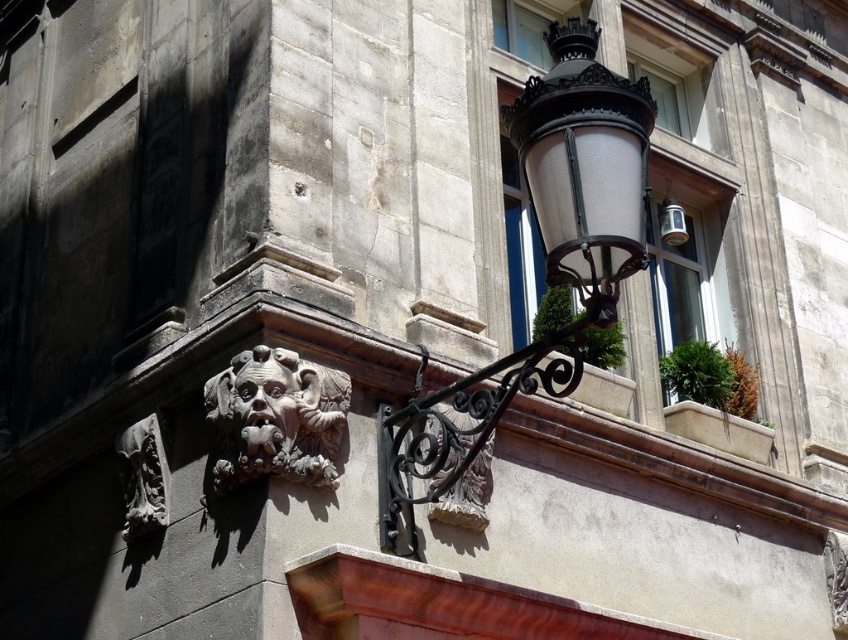
Looking at this image, can you confirm if black wrought iron streetlight at upper right is positioned to the left of carved stone gargoyle at lower left?

No, black wrought iron streetlight at upper right is not to the left of carved stone gargoyle at lower left.

Describe the element at coordinates (544, 259) in the screenshot. I see `black wrought iron streetlight at upper right` at that location.

This screenshot has height=640, width=848. Find the location of `black wrought iron streetlight at upper right`. black wrought iron streetlight at upper right is located at coordinates (544, 259).

Who is positioned more to the left, carved stone gargoyle at center-left or carved stone gargoyle at lower left?

Positioned to the left is carved stone gargoyle at lower left.

Describe the element at coordinates (276, 419) in the screenshot. I see `carved stone gargoyle at center-left` at that location.

Find the location of `carved stone gargoyle at center-left`. carved stone gargoyle at center-left is located at coordinates (276, 419).

Which is more to the right, black wrought iron streetlight at upper right or carved stone gargoyle at center-left?

black wrought iron streetlight at upper right

Is black wrought iron streetlight at upper right taller than carved stone gargoyle at center-left?

Yes, black wrought iron streetlight at upper right is taller than carved stone gargoyle at center-left.

Who is more distant from viewer, (466, 387) or (237, 454)?

The point (466, 387) is more distant.

Where is `black wrought iron streetlight at upper right`? black wrought iron streetlight at upper right is located at coordinates tap(544, 259).